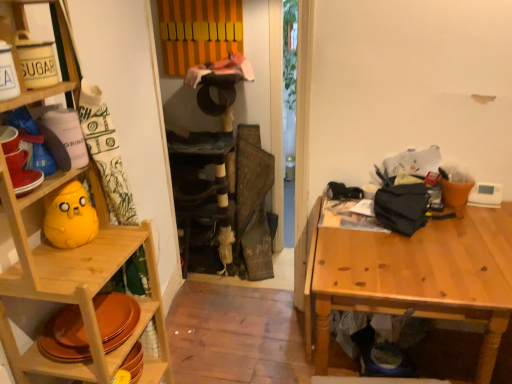
Locate an element on the screen. wooden shelf at left is located at coordinates (132, 83).

Find the location of a particular element. wooden shelf at left is located at coordinates (132, 83).

The width and height of the screenshot is (512, 384). What are the coordinates of `shelf below the matte yellow plush at left (from the image's perspective)` in the screenshot? It's located at (132, 83).

What's the angular difference between matte yellow plush at left and wooden shelf at left's facing directions?

2.83 degrees separate the facing orientations of matte yellow plush at left and wooden shelf at left.

Does matte yellow plush at left come behind wooden shelf at left?

Yes, matte yellow plush at left is behind wooden shelf at left.

From the image's perspective, is matte yellow plush at left beneath wooden shelf at left?

No.

Considering the sizes of wooden table at right and matte yellow plush at left in the image, is wooden table at right taller or shorter than matte yellow plush at left?

In the image, wooden table at right appears to be taller than matte yellow plush at left.

Is wooden table at right oriented away from matte yellow plush at left?

wooden table at right is not turned away from matte yellow plush at left.

From a real-world perspective, is wooden table at right positioned over matte yellow plush at left based on gravity?

No, from a real-world perspective, wooden table at right is not over matte yellow plush at left

Would you say wooden table at right is outside matte yellow plush at left?

Yes, wooden table at right is located beyond the bounds of matte yellow plush at left.

Is wooden shelf at left closer to camera compared to wooden table at right?

Yes, it is.

Locate an element on the screen. The width and height of the screenshot is (512, 384). table located underneath the wooden shelf at left (from a real-world perspective) is located at coordinates (416, 277).

Between wooden shelf at left and wooden table at right, which one appears on the right side from the viewer's perspective?

wooden table at right is more to the right.

From the image's perspective, does wooden shelf at left appear higher than wooden table at right?

Yes, from the image's perspective, wooden shelf at left is over wooden table at right.

Considering the positions of objects wooden shelf at left and matte yellow plush at left in the image provided, who is in front, wooden shelf at left or matte yellow plush at left?

wooden shelf at left is more forward.

Considering the positions of point (111, 87) and point (49, 219), is point (111, 87) closer or farther from the camera than point (49, 219)?

Point (111, 87).

Is wooden shelf at left taller than matte yellow plush at left?

Yes, wooden shelf at left is taller than matte yellow plush at left.

Is the surface of wooden shelf at left in direct contact with matte yellow plush at left?

No, wooden shelf at left is not making contact with matte yellow plush at left.

From the image's perspective, is matte yellow plush at left beneath wooden table at right?

Incorrect, from the image's perspective, matte yellow plush at left is higher than wooden table at right.

Does point (72, 194) lie behind point (333, 242)?

That is False.

Considering their positions, is matte yellow plush at left located in front of or behind wooden table at right?

matte yellow plush at left is in front of wooden table at right.

Is matte yellow plush at left inside or outside of wooden table at right?

matte yellow plush at left lies outside wooden table at right.

From the image's perspective, between wooden table at right and wooden shelf at left, who is located below?

wooden table at right is shown below in the image.

From a real-world perspective, is wooden table at right on top of wooden shelf at left?

No, from a real-world perspective, wooden table at right is not on top of wooden shelf at left.

Which is more to the left, wooden table at right or wooden shelf at left?

Positioned to the left is wooden shelf at left.

Is wooden table at right wider or thinner than wooden shelf at left?

Considering their sizes, wooden table at right looks broader than wooden shelf at left.

The image size is (512, 384). I want to click on toy that appears above the wooden shelf at left (from a real-world perspective), so click(69, 217).

You are a GUI agent. You are given a task and a screenshot of the screen. Output one action in this format:
    pyautogui.click(x=<x>, y=<y>)
    Task: Click on the table lying on the right of matte yellow plush at left
    
    Given the screenshot: What is the action you would take?
    pyautogui.click(x=416, y=277)

When comparing their distances from wooden shelf at left, does wooden table at right or matte yellow plush at left seem further?

Based on the image, wooden table at right appears to be further to wooden shelf at left.

When comparing their distances from wooden shelf at left, does matte yellow plush at left or wooden table at right seem closer?

matte yellow plush at left lies closer to wooden shelf at left than the other object.

From the image, which object appears to be farther from wooden table at right, wooden shelf at left or matte yellow plush at left?

Based on the image, wooden shelf at left appears to be further to wooden table at right.

Which object lies further to the anchor point wooden table at right, matte yellow plush at left or wooden shelf at left?

wooden shelf at left.

Estimate the real-world distances between objects in this image. Which object is further from matte yellow plush at left, wooden table at right or wooden shelf at left?

Based on the image, wooden table at right appears to be further to matte yellow plush at left.

In the scene shown: Which object lies further to the anchor point matte yellow plush at left, wooden shelf at left or wooden table at right?

The object further to matte yellow plush at left is wooden table at right.

In order to click on shelf between matte yellow plush at left and wooden table at right in this screenshot , I will do `click(132, 83)`.